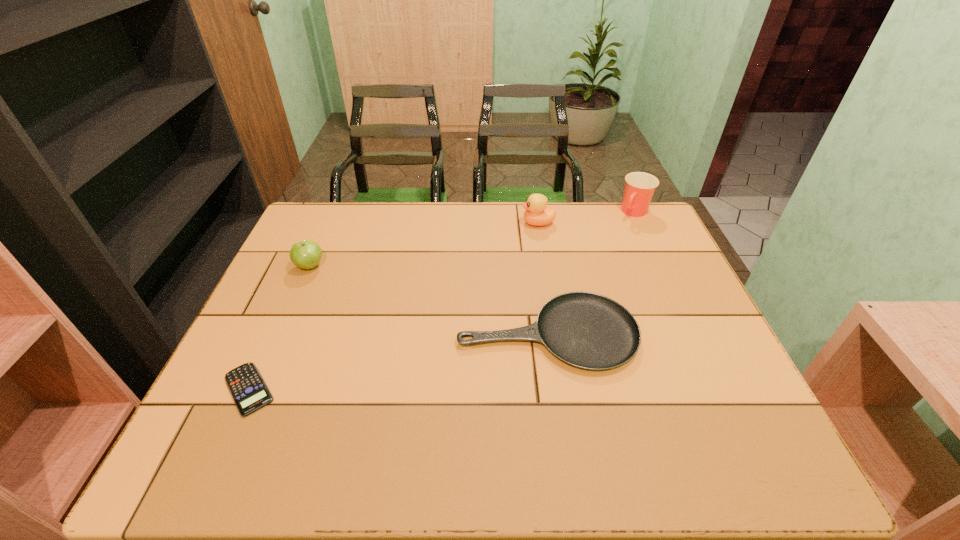
Locate an element on the screen. The height and width of the screenshot is (540, 960). the rightmost object is located at coordinates (639, 188).

Identify the location of duckling. This screenshot has width=960, height=540. (536, 213).

The height and width of the screenshot is (540, 960). In order to click on the third nearest object in this screenshot , I will do `click(306, 254)`.

You are a GUI agent. You are given a task and a screenshot of the screen. Output one action in this format:
    pyautogui.click(x=<x>, y=<y>)
    Task: Click on the second shortest object
    The width and height of the screenshot is (960, 540).
    Given the screenshot: What is the action you would take?
    pyautogui.click(x=586, y=330)

I want to click on calculator, so click(248, 389).

Where is `vacant area situated 0.350m on the left of the cup`? The width and height of the screenshot is (960, 540). vacant area situated 0.350m on the left of the cup is located at coordinates (514, 212).

The height and width of the screenshot is (540, 960). I want to click on vacant position located 0.080m on the face of the duckling, so click(x=496, y=223).

The width and height of the screenshot is (960, 540). Find the location of `vacant area situated on the face of the duckling`. vacant area situated on the face of the duckling is located at coordinates (493, 223).

The height and width of the screenshot is (540, 960). Find the location of `vacant space located on the face of the duckling`. vacant space located on the face of the duckling is located at coordinates (456, 223).

Where is `vacant space located on the right of the third farthest object`? vacant space located on the right of the third farthest object is located at coordinates (461, 266).